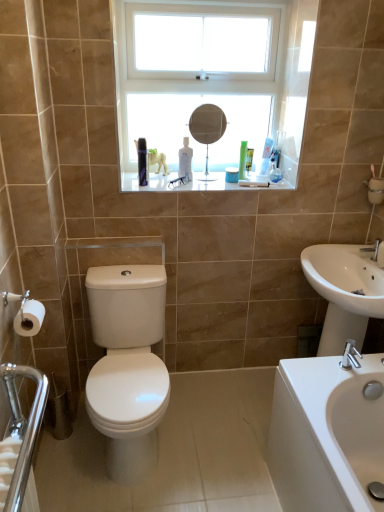
Locate an element on the screen. This screenshot has width=384, height=512. free space in front of green matte bottle at upper center, placed as the first toiletry when sorted from left to right is located at coordinates (241, 186).